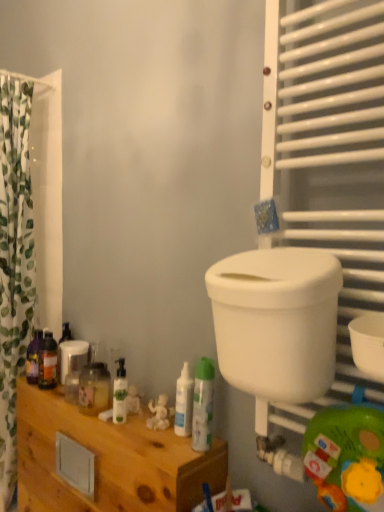
I want to click on vacant space to the right of white glossy pump bottle at center, the 3th toiletry when ordered from left to right, so click(161, 430).